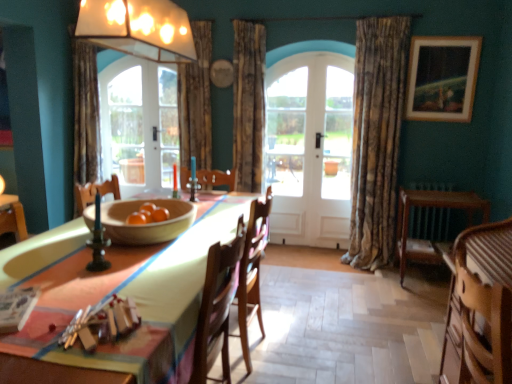
Question: Could wooden striped armchair at lower right be considered to be inside clear glass door at center?

Choices:
 (A) no
 (B) yes

Answer: (A)

Question: From a real-world perspective, is clear glass door at center over wooden striped armchair at lower right?

Choices:
 (A) no
 (B) yes

Answer: (B)

Question: Considering the relative positions of clear glass door at center and wooden striped armchair at lower right in the image provided, is clear glass door at center to the left of wooden striped armchair at lower right from the viewer's perspective?

Choices:
 (A) no
 (B) yes

Answer: (B)

Question: Does clear glass door at center come behind wooden striped armchair at lower right?

Choices:
 (A) no
 (B) yes

Answer: (B)

Question: Is clear glass door at center not near wooden striped armchair at lower right?

Choices:
 (A) yes
 (B) no

Answer: (A)

Question: From a real-world perspective, is wooden striped armchair at lower right above or below wooden bowl at center?

Choices:
 (A) above
 (B) below

Answer: (B)

Question: Looking at their shapes, would you say wooden striped armchair at lower right is wider or thinner than wooden bowl at center?

Choices:
 (A) thin
 (B) wide

Answer: (A)

Question: Visually, is wooden striped armchair at lower right positioned to the left or to the right of wooden bowl at center?

Choices:
 (A) left
 (B) right

Answer: (B)

Question: In terms of height, does wooden striped armchair at lower right look taller or shorter compared to wooden bowl at center?

Choices:
 (A) short
 (B) tall

Answer: (B)

Question: Looking at the image, does wooden chair at center seem bigger or smaller compared to textured brown curtain at center, marked as the second curtain in a right-to-left arrangement?

Choices:
 (A) big
 (B) small

Answer: (B)

Question: From a real-world perspective, is wooden chair at center physically located above or below textured brown curtain at center, which is counted as the 2th curtain, starting from the left?

Choices:
 (A) below
 (B) above

Answer: (A)

Question: Considering the positions of point (268, 195) and point (263, 56), is point (268, 195) closer or farther from the camera than point (263, 56)?

Choices:
 (A) farther
 (B) closer

Answer: (A)

Question: Is wooden chair at center spatially inside textured brown curtain at center, which is counted as the 2th curtain, starting from the left, or outside of it?

Choices:
 (A) inside
 (B) outside

Answer: (B)

Question: Is wooden striped armchair at lower right wider or thinner than wooden round table at right?

Choices:
 (A) wide
 (B) thin

Answer: (B)

Question: Would you say wooden striped armchair at lower right is to the left or to the right of wooden round table at right in the picture?

Choices:
 (A) right
 (B) left

Answer: (B)